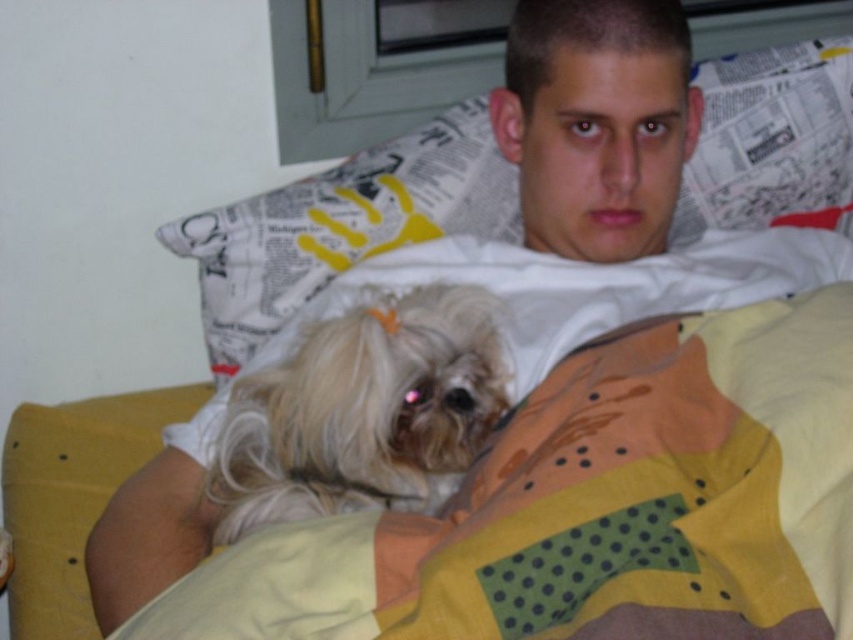
Question: Is white newspaper at upper center wider than white fluffy dog at center?

Choices:
 (A) no
 (B) yes

Answer: (B)

Question: Can you confirm if yellow dotted fabric at lower center is positioned to the left of white fluffy dog at center?

Choices:
 (A) no
 (B) yes

Answer: (A)

Question: Does white newspaper at upper center appear under white fluffy dog at center?

Choices:
 (A) yes
 (B) no

Answer: (B)

Question: Which point appears farthest from the camera in this image?

Choices:
 (A) click(x=775, y=337)
 (B) click(x=692, y=237)

Answer: (B)

Question: Which point appears closest to the camera in this image?

Choices:
 (A) (399, 163)
 (B) (291, 465)

Answer: (B)

Question: Estimate the real-world distances between objects in this image. Which object is farther from the yellow dotted fabric at lower center?

Choices:
 (A) white newspaper at upper center
 (B) white fluffy dog at center

Answer: (A)